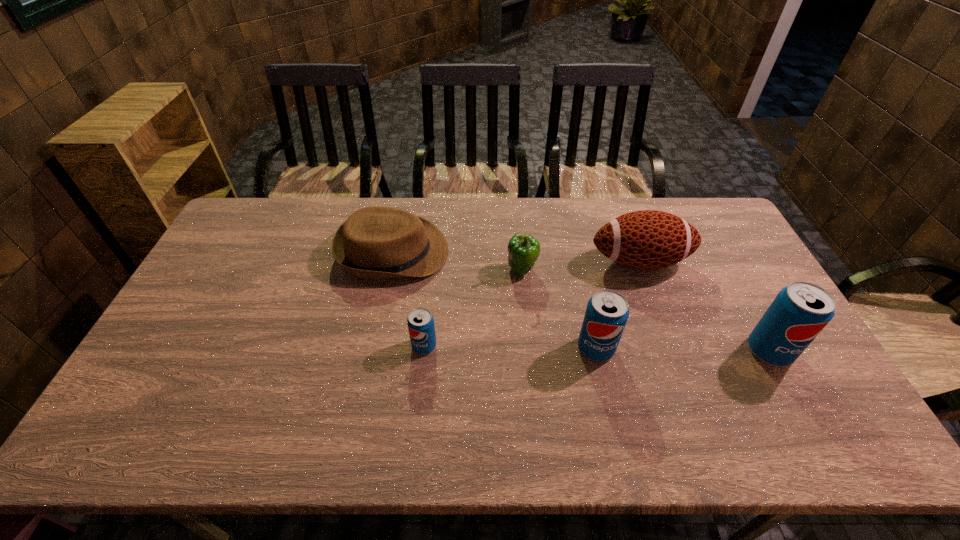
Find the location of a particular element. This screenshot has width=960, height=540. free space located 0.150m on the front-facing side of the fedora is located at coordinates (493, 252).

At what (x,y) coordinates should I click in order to perform the action: click on vacant space positioned on the right of the football. Please return your answer as a coordinate pair (x, y). The image size is (960, 540). Looking at the image, I should click on (736, 261).

The image size is (960, 540). In order to click on object positioned at the far edge in this screenshot , I will do `click(376, 242)`.

I want to click on object that is at the right edge, so click(x=800, y=311).

The height and width of the screenshot is (540, 960). In the image, there is a desktop. In order to click on free space at the far edge in this screenshot , I will do pos(582,237).

This screenshot has height=540, width=960. In the image, there is a desktop. Find the location of `vacant space at the near edge`. vacant space at the near edge is located at coordinates (744, 382).

Find the location of `free space at the left edge of the desktop`. free space at the left edge of the desktop is located at coordinates (187, 319).

In the image, there is a desktop. Where is `vacant area at the right edge`? The height and width of the screenshot is (540, 960). vacant area at the right edge is located at coordinates (740, 341).

The width and height of the screenshot is (960, 540). In order to click on vacant space that's between the football and the bell pepper in this screenshot , I will do `click(581, 266)`.

I want to click on vacant region between the fedora and the bell pepper, so click(458, 261).